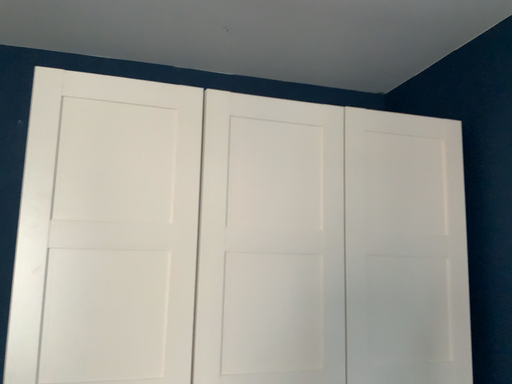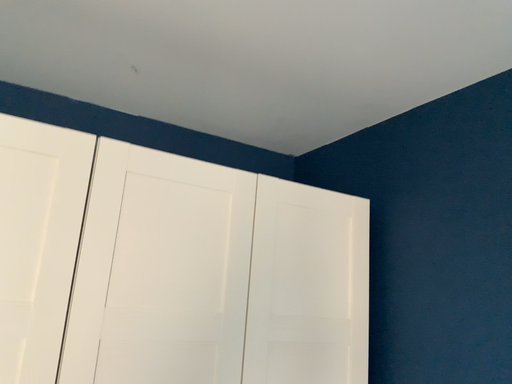
Question: Which way did the camera rotate in the video?

Choices:
 (A) rotated left
 (B) rotated right

Answer: (B)